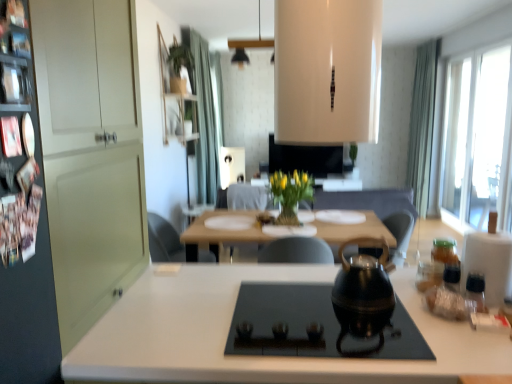
The image size is (512, 384). Find the location of `free location above black glass cooktop at center (from a real-world perspective)`. free location above black glass cooktop at center (from a real-world perspective) is located at coordinates (310, 318).